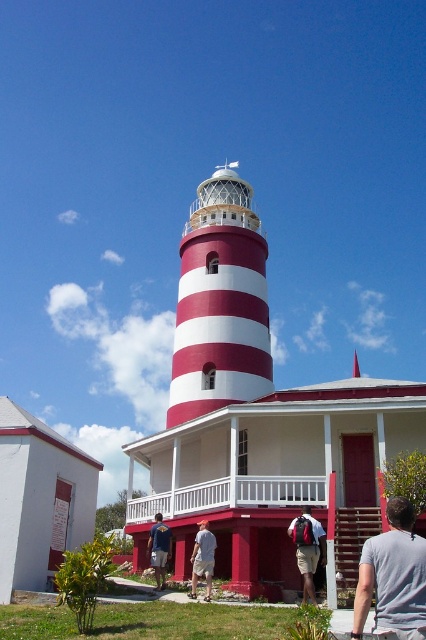
Does white cotton shirt at center have a greater height compared to blue denim shorts at lower center?

Yes, white cotton shirt at center is taller than blue denim shorts at lower center.

Does white cotton shirt at center lie behind blue denim shorts at lower center?

No.

Is point (206, 573) closer to viewer compared to point (161, 584)?

Yes, it is in front of point (161, 584).

At what (x,y) coordinates should I click in order to perform the action: click on white cotton shirt at center. Please return your answer as a coordinate pair (x, y). Looking at the image, I should click on (203, 557).

Between point (305, 572) and point (157, 560), which one is positioned behind?

The point (157, 560) is more distant.

How far apart are matte black backpack at lower center and blue denim shorts at lower center?

matte black backpack at lower center is 8.65 meters from blue denim shorts at lower center.

The height and width of the screenshot is (640, 426). What are the coordinates of `matte black backpack at lower center` in the screenshot? It's located at (307, 548).

Does gray cotton t-shirt at center appear on the left side of matte black backpack at lower center?

In fact, gray cotton t-shirt at center is to the right of matte black backpack at lower center.

Find the location of a particular element. The width and height of the screenshot is (426, 640). gray cotton t-shirt at center is located at coordinates (393, 577).

I want to click on gray cotton t-shirt at center, so click(393, 577).